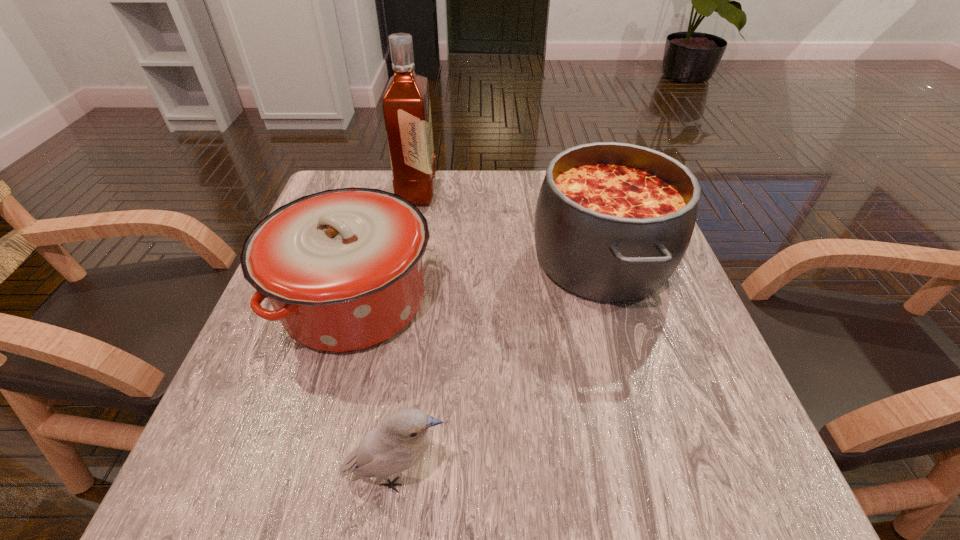
Identify the location of free space that is in between the left casserole and the rightmost object. point(478,280).

Identify the location of free space between the shortest object and the left casserole. The width and height of the screenshot is (960, 540). (375, 388).

The width and height of the screenshot is (960, 540). Find the location of `free space between the tallest object and the shortest object`. free space between the tallest object and the shortest object is located at coordinates (407, 334).

This screenshot has width=960, height=540. Identify the location of free space between the right casserole and the left casserole. (478, 280).

The height and width of the screenshot is (540, 960). In order to click on unoccupied area between the liquor and the right casserole in this screenshot , I will do coord(510,226).

At what (x,y) coordinates should I click in order to perform the action: click on empty space that is in between the nearest object and the tallest object. Please return your answer as a coordinate pair (x, y). Looking at the image, I should click on point(407,334).

Locate an element on the screen. The width and height of the screenshot is (960, 540). vacant point located between the left casserole and the rightmost object is located at coordinates (478, 280).

Choose which object is the second nearest neighbor to the shortest object. Please provide its 2D coordinates. Your answer should be formatted as a tuple, i.e. [(x, y)], where the tuple contains the x and y coordinates of a point satisfying the conditions above.

[(613, 221)]

Where is `object that is the nearest to the bird`? The image size is (960, 540). object that is the nearest to the bird is located at coordinates (342, 268).

Image resolution: width=960 pixels, height=540 pixels. In order to click on free point that satisfies the following two spatial constraints: 1. on the front label of the rightmost object; 2. on the right side of the liquor in this screenshot , I will do `click(405, 260)`.